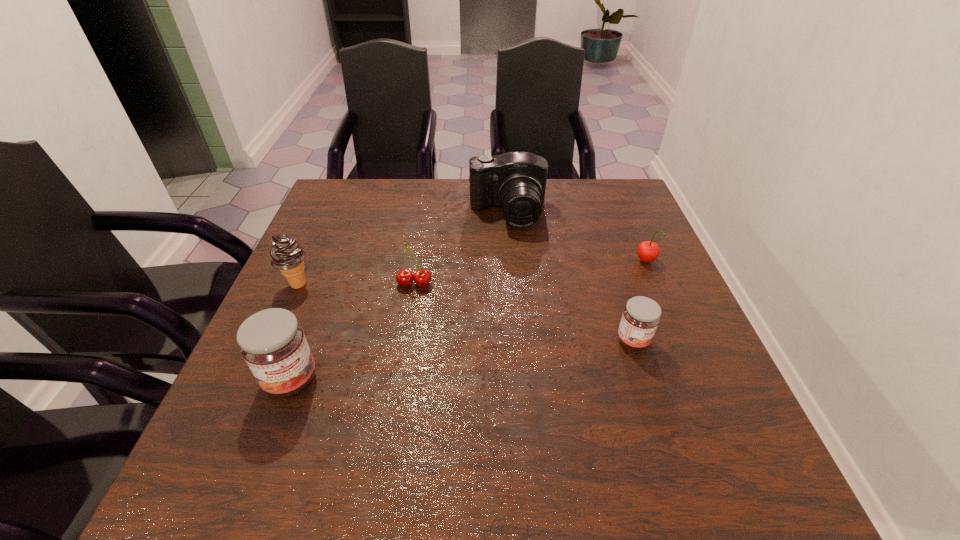
To achieve even spacing by inserting another jam among them, please point to a vacant spot for this new jam. Please provide its 2D coordinates. Your answer should be formatted as a tuple, i.e. [(x, y)], where the tuple contains the x and y coordinates of a point satisfying the conditions above.

[(468, 360)]